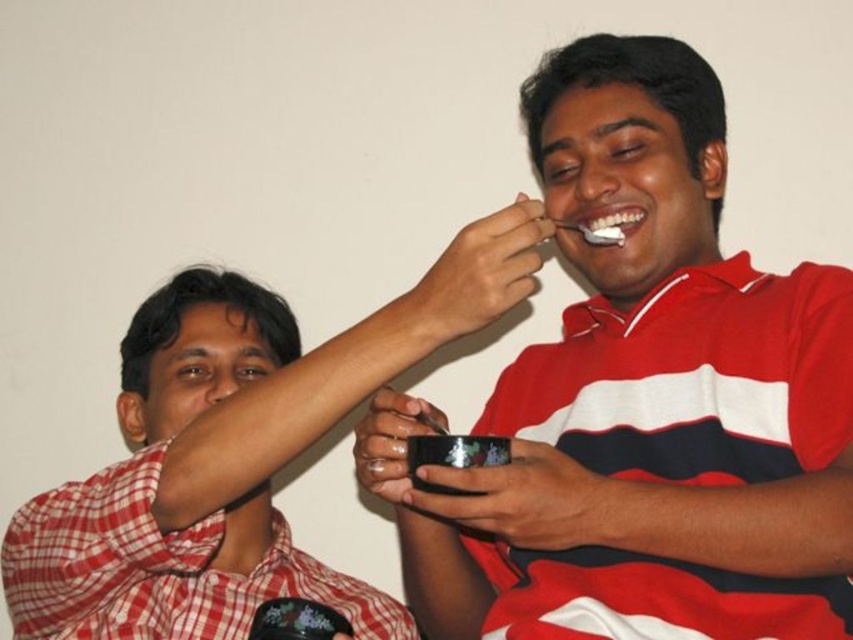
Find the location of a particular element. matte black bowl at center is located at coordinates coord(643,401).

Which of these two, matte black bowl at upper center or white glossy teeth at upper center, stands taller?

With more height is matte black bowl at upper center.

At what (x,y) coordinates should I click in order to perform the action: click on matte black bowl at upper center. Please return your answer as a coordinate pair (x, y). The width and height of the screenshot is (853, 640). Looking at the image, I should click on (236, 458).

Between point (408, 355) and point (602, 234), which one is positioned in front?

Positioned in front is point (408, 355).

Identify the location of matte black bowl at upper center. (236, 458).

Is point (663, 141) closer to camera compared to point (207, 340)?

That is True.

Which of these two, matte black bowl at center or matte black bowl at upper center, stands shorter?

With less height is matte black bowl at upper center.

Who is more forward, (x=740, y=324) or (x=492, y=257)?

Point (x=492, y=257) is in front.

Find the location of a particular element. matte black bowl at center is located at coordinates (643, 401).